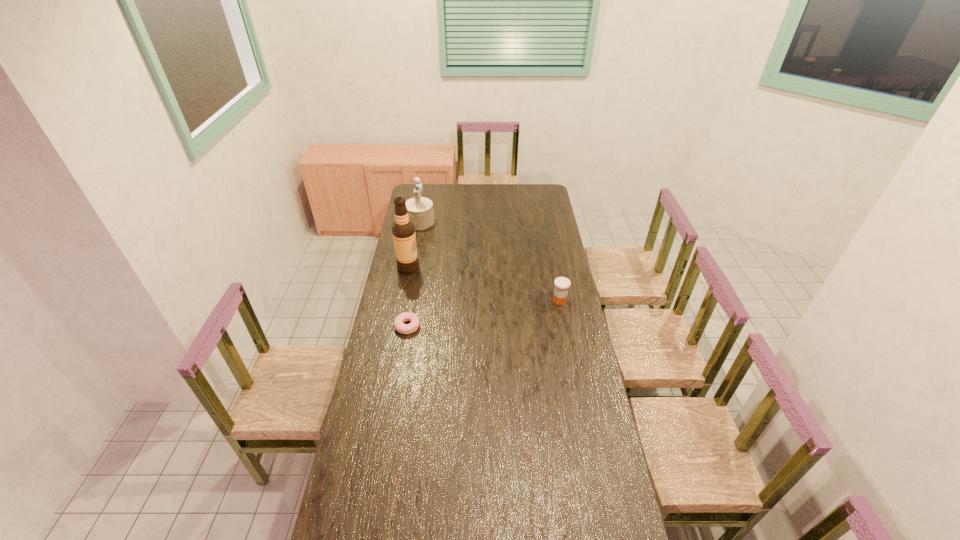
This screenshot has width=960, height=540. I want to click on free space located at the beak of the figurine, so click(x=454, y=257).

Find the location of a particular element. The width and height of the screenshot is (960, 540). blank space located at the beak of the figurine is located at coordinates (457, 260).

At what (x,y) coordinates should I click in order to perform the action: click on vacant region located 0.380m on the label of the tallest object. Please return your answer as a coordinate pair (x, y). Looking at the image, I should click on (475, 301).

At what (x,y) coordinates should I click in order to perform the action: click on free space located 0.090m on the label of the tallest object. Please return your answer as a coordinate pair (x, y). The width and height of the screenshot is (960, 540). Looking at the image, I should click on (430, 278).

The height and width of the screenshot is (540, 960). In order to click on free point located 0.360m on the label of the tallest object in this screenshot , I will do `click(471, 300)`.

Where is `doughnut that is positioned at the left edge`? This screenshot has height=540, width=960. doughnut that is positioned at the left edge is located at coordinates (399, 325).

Find the location of a particular element. This screenshot has width=960, height=540. figurine present at the left edge is located at coordinates (420, 209).

Where is `alcohol that is at the left edge`? The width and height of the screenshot is (960, 540). alcohol that is at the left edge is located at coordinates (403, 230).

Locate an element on the screen. object positioned at the right edge is located at coordinates (562, 284).

In the image, there is a desktop. Identify the location of vacant space at the far edge. (460, 198).